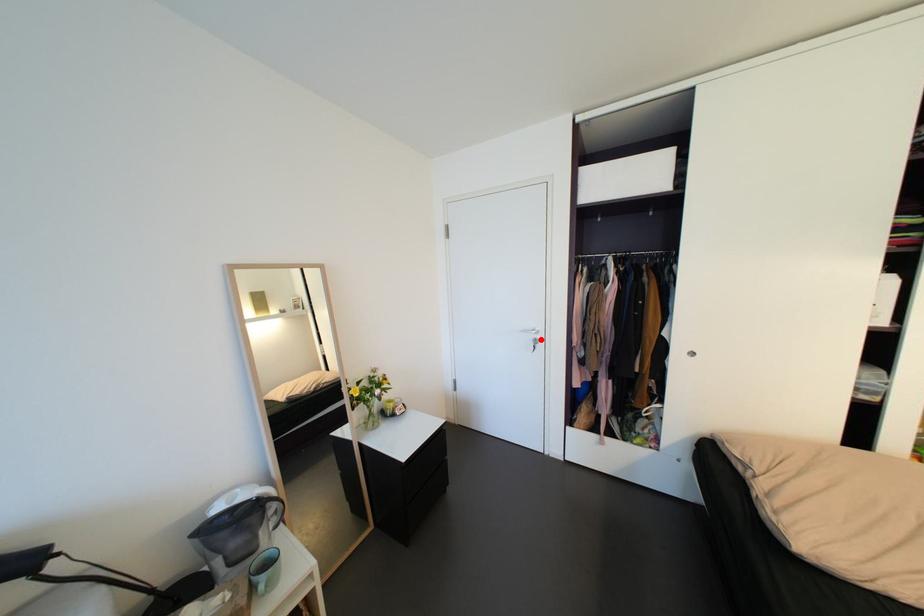
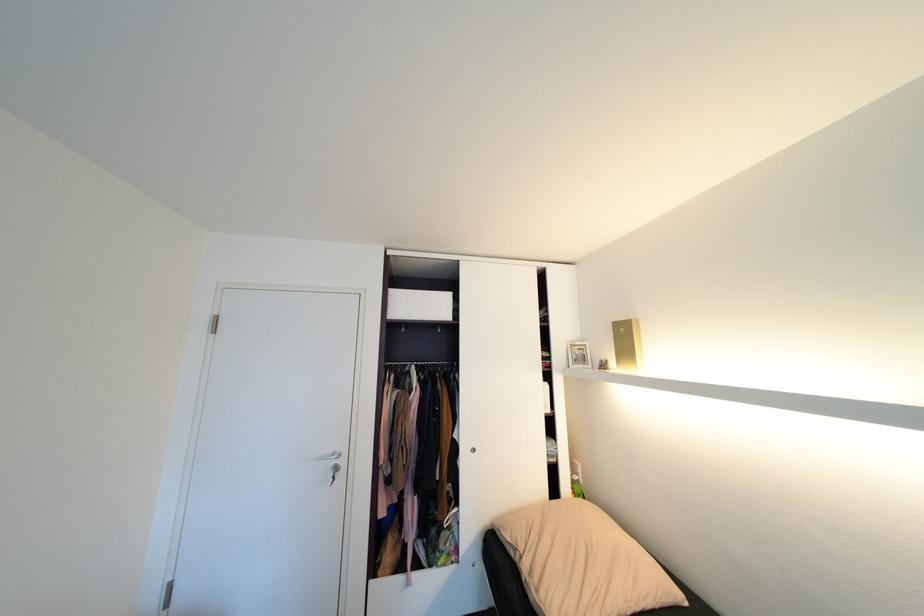
Question: I am providing you with two images of the same scene from different viewpoints. A red point is marked on the first image. At the location where the point appears in image 1, is it still visible in image 2?

Choices:
 (A) Yes
 (B) No

Answer: (A)